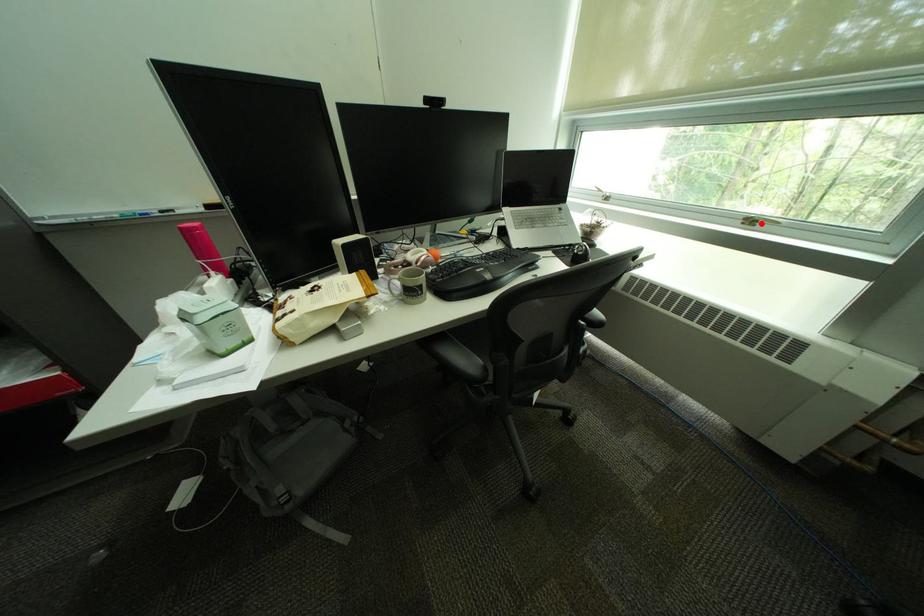
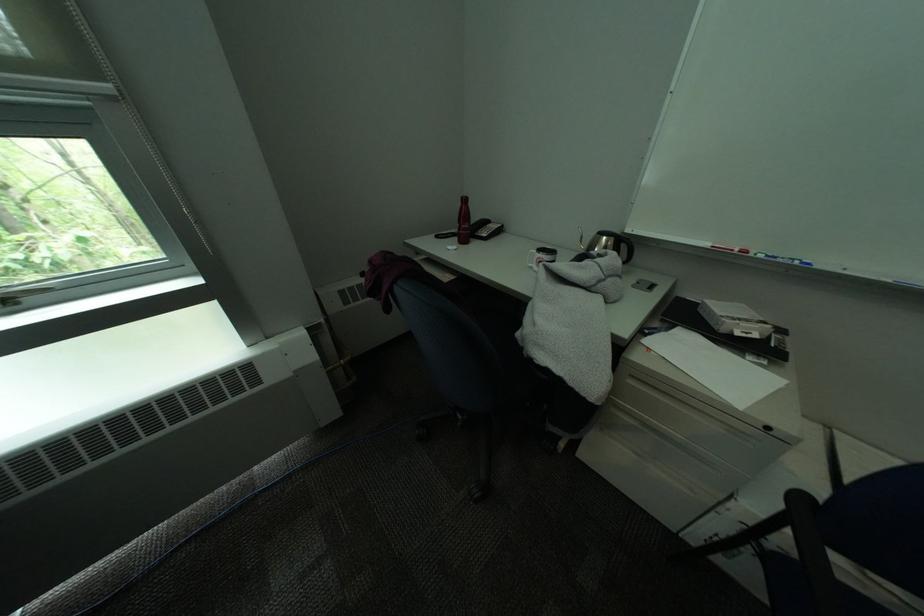
Where in the second image is the point corresponding to the highlighted location from the first image?

(15, 302)